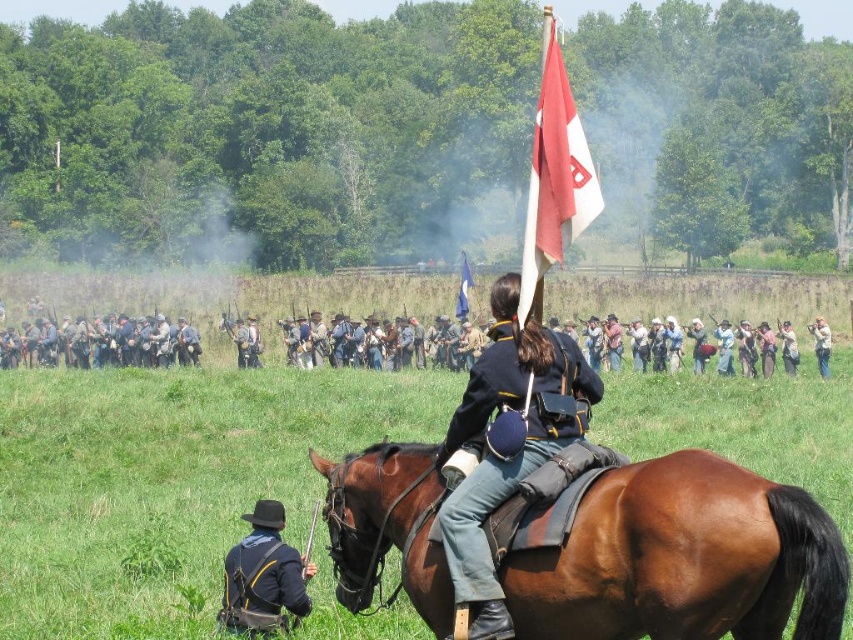
Question: Can you confirm if light brown leather jacket at right is wider than blue fabric flag at center?

Choices:
 (A) yes
 (B) no

Answer: (B)

Question: Can you confirm if blue cotton uniform at center is positioned to the left of black matte uniform at lower left?

Choices:
 (A) yes
 (B) no

Answer: (B)

Question: Which point is closer to the camera?

Choices:
 (A) blue cotton uniform at center
 (B) light brown leather jacket at right
 (C) blue fabric flag at center
 (D) blue uniform at center

Answer: (A)

Question: Is brown leather saddle at center thinner than light brown leather jacket at right?

Choices:
 (A) yes
 (B) no

Answer: (B)

Question: Which point appears farthest from the camera in this image?

Choices:
 (A) (474, 412)
 (B) (57, 364)
 (C) (297, 592)

Answer: (B)

Question: Which point is farther to the camera?

Choices:
 (A) brown leather saddle at center
 (B) black matte uniform at lower left
 (C) blue fabric flag at center
 (D) blue cotton uniform at center

Answer: (C)